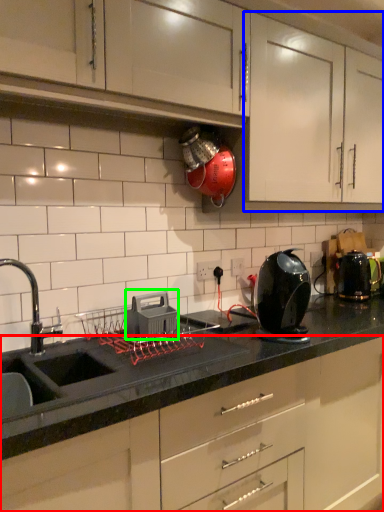
Question: Which object is positioned farthest from cabinetry (highlighted by a red box)? Select from cabinetry (highlighted by a blue box) and appliance (highlighted by a green box).

Choices:
 (A) cabinetry
 (B) appliance

Answer: (A)